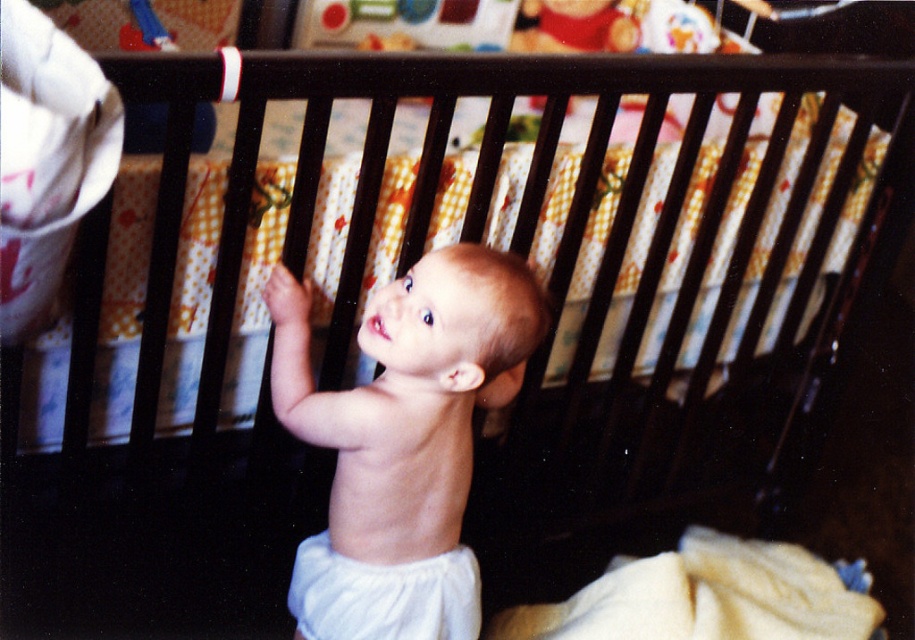
Consider the image. You are a parent trying to choose between the smooth white diaper at center and the white cloth diaper at center for your baby. Based on their sizes, which one would you recommend?

The smooth white diaper at center is wider than the white cloth diaper at center, so it might provide more coverage and comfort for the baby.

A baby is standing inside a dark wooden crib. The baby is looking upwards. There is a yellow blanket partially draped over the side of the crib. A point labeled as point (504,344) is located 3.88 feet away from the baby. If the baby wants to reach that point, can they do so while staying inside the crib?

The point labeled as point (504,344) is 3.88 feet away from the baby. Since the baby is inside the crib, they would need to stretch or move towards it, but without knowing the crib dimensions or the baby s reaching ability, it s impossible to determine if they can reach the point while staying inside the crib.